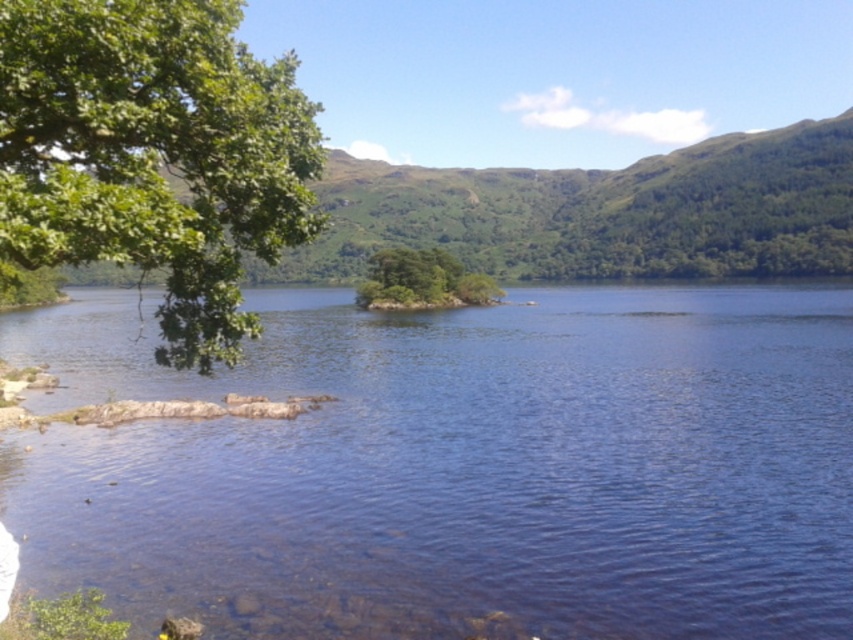
You are standing at the point with coordinates point (51, 253) and want to reach the point with coordinates point (711, 420). According to the image, is the destination point behind or in front of your current position?

The point (711, 420) is behind point (51, 253), so the destination point is behind your current position.

You are standing at the center of the image and want to locate the green leafy branch at upper left. According to the coordinates provided, in which direction should you turn to face it?

The green leafy branch at upper left is located at coordinates point (x=154, y=154), which is in the upper left direction from your current position at the center. You should turn to your left to face it.